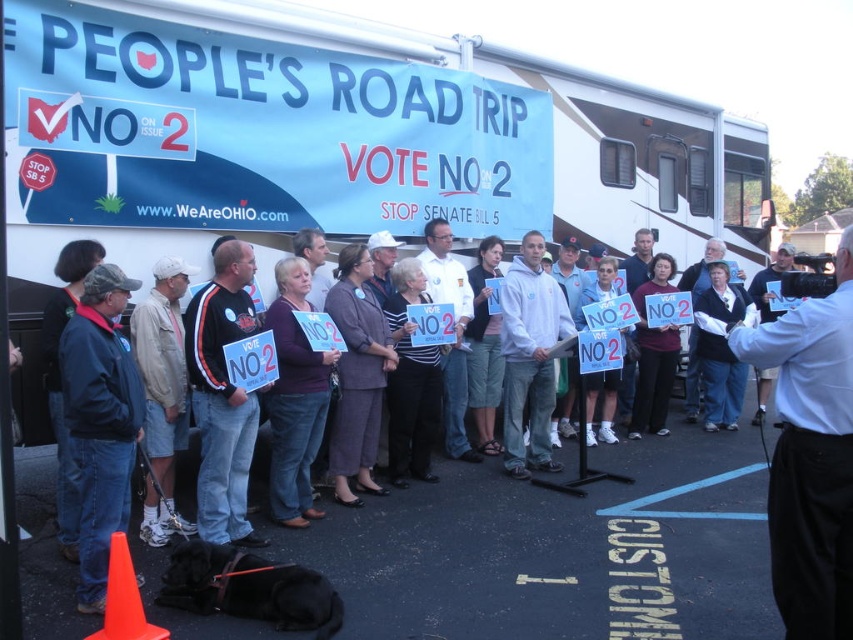
You are a photographer at the event and need to arrange the participants for a group photo. If you want to place the person in the white shirt at center to the left of the denim jacket at left, would that require moving them to the right or left?

The white shirt at center is currently to the right of the denim jacket at left. To place the white shirt at center to the left of the denim jacket at left, you would need to move them to the left.

You are standing at the camera position and want to reach the point marked at coordinates point (837, 522). If you take a step forward of 10 feet, will you pass that point?

The point marked at coordinates point (837, 522) is 9.79 feet away from the camera. Taking a step forward of 10 feet will move you past that point since 10 feet is greater than 9.79 feet.